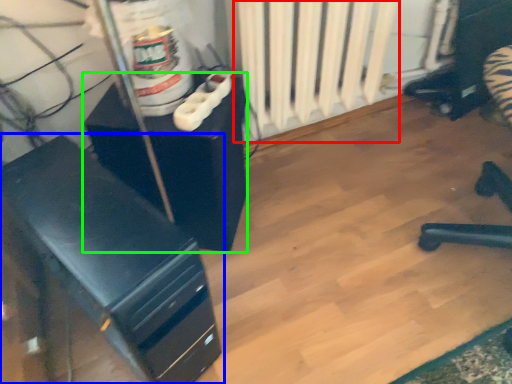
Question: Considering the real-world distances, which object is farthest from radiator (highlighted by a red box)? furniture (highlighted by a blue box) or furniture (highlighted by a green box)?

Choices:
 (A) furniture
 (B) furniture

Answer: (A)